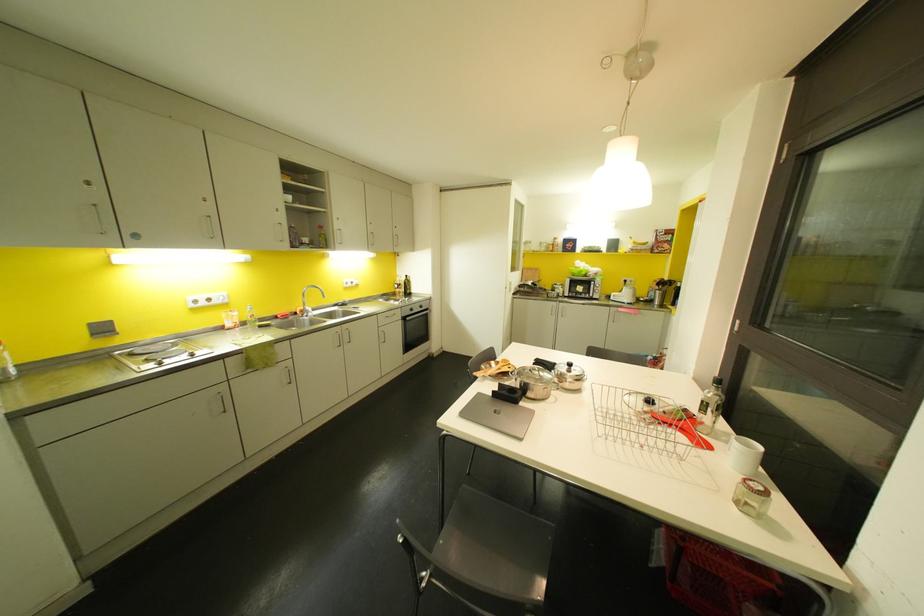
What do you see at coordinates (310, 293) in the screenshot?
I see `the faucet handle` at bounding box center [310, 293].